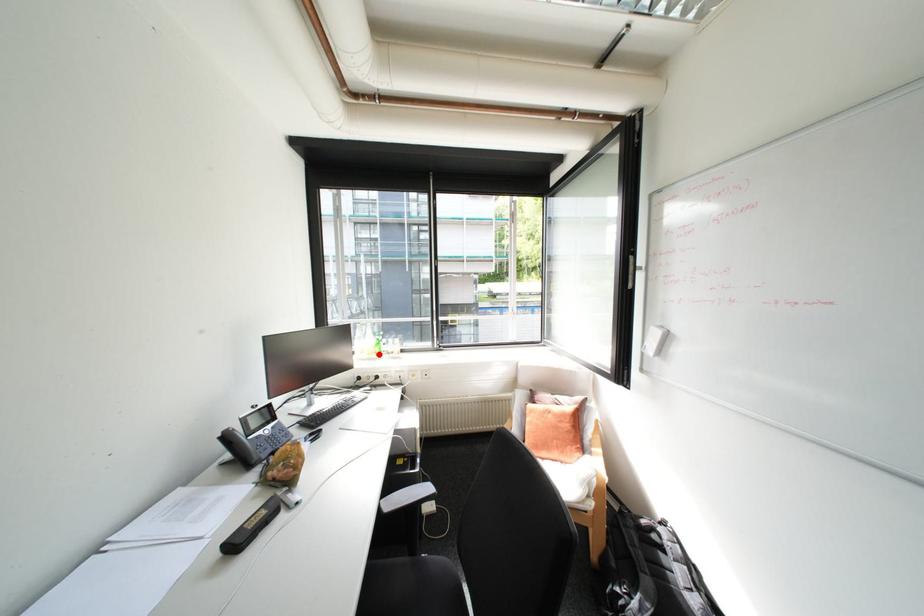
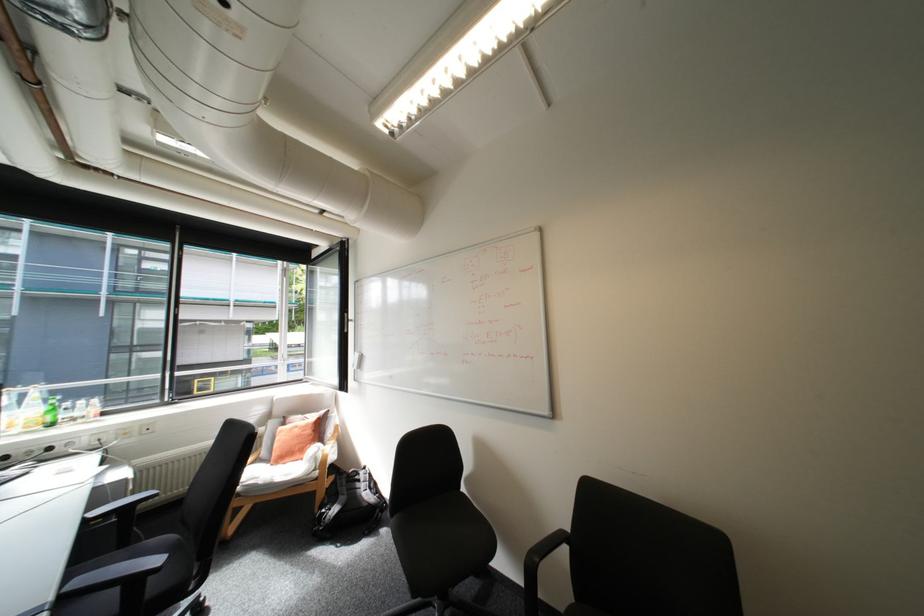
The point at the highlighted location is marked in the first image. Where is the corresponding point in the second image?

(38, 427)